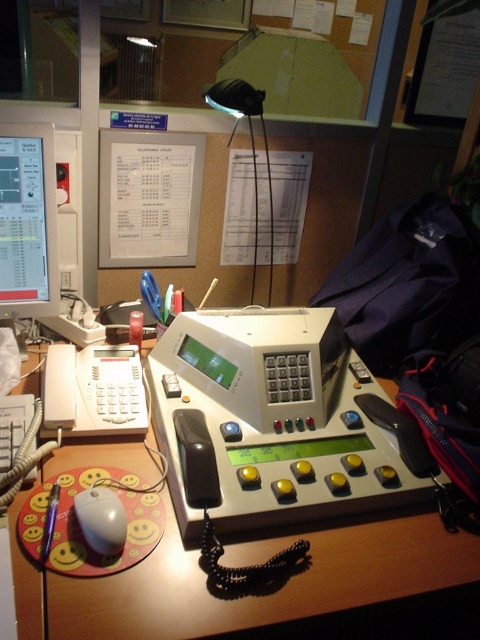
You are organizing the desk items and need to place a new item between the matte black monitor at upper left and the white matte mouse at lower left. Based on their positions, where should you place the new item?

The new item should be placed between the matte black monitor at upper left and the white matte mouse at lower left, positioned below the matte black monitor at upper left and above the white matte mouse at lower left since the matte black monitor at upper left is above the white matte mouse at lower left.

You are organizing your desk and need to know the distance between the white plastic telephone at left and the white matte mouse at lower left. Can you confirm if the distance is less than 10 inches?

The white plastic telephone at left is 8.82 inches from white matte mouse at lower left, so yes, the distance is less than 10 inches.

You are organizing the desk and need to place a new item between the matte black monitor at upper left and the white plastic telephone at left. Is there enough space for this new item?

The matte black monitor at upper left is positioned over the white plastic telephone at left, meaning they are stacked vertically. Since they are not side by side, there is no horizontal space between them to place a new item.